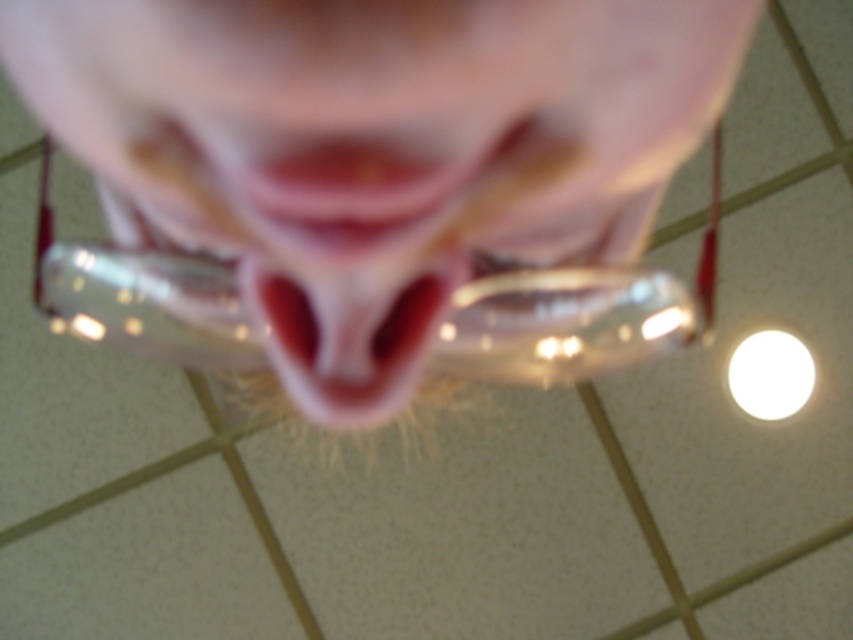
Does pink translucent glasses at center have a greater width compared to pink glossy lips at center?

Correct, the width of pink translucent glasses at center exceeds that of pink glossy lips at center.

Between pink translucent glasses at center and pink glossy lips at center, which one appears on the right side from the viewer's perspective?

pink translucent glasses at center

Between point (229, 250) and point (291, 211), which one is positioned behind?

Point (229, 250)

This screenshot has height=640, width=853. In order to click on pink translucent glasses at center in this screenshot , I will do `click(375, 147)`.